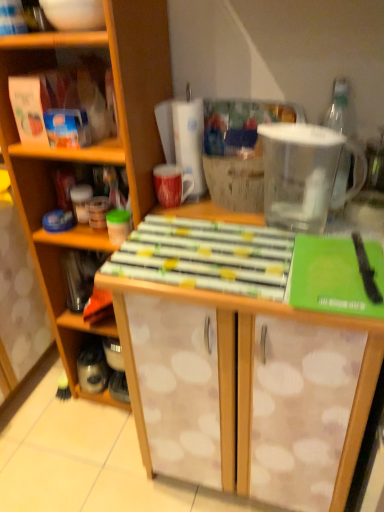
Question: Is white dotted wood cabinet at center positioned beyond the bounds of transparent plastic pitcher at upper right?

Choices:
 (A) yes
 (B) no

Answer: (A)

Question: From the image's perspective, is white dotted wood cabinet at center under transparent plastic pitcher at upper right?

Choices:
 (A) no
 (B) yes

Answer: (B)

Question: Considering the relative sizes of white dotted wood cabinet at center and transparent plastic pitcher at upper right in the image provided, is white dotted wood cabinet at center shorter than transparent plastic pitcher at upper right?

Choices:
 (A) yes
 (B) no

Answer: (B)

Question: From a real-world perspective, is white dotted wood cabinet at center beneath transparent plastic pitcher at upper right?

Choices:
 (A) no
 (B) yes

Answer: (B)

Question: Can you confirm if white dotted wood cabinet at center is smaller than transparent plastic pitcher at upper right?

Choices:
 (A) yes
 (B) no

Answer: (B)

Question: Does white dotted wood cabinet at center appear on the right side of transparent plastic pitcher at upper right?

Choices:
 (A) no
 (B) yes

Answer: (A)

Question: From a real-world perspective, is wooden table at center located higher than white dotted wood cabinet at center?

Choices:
 (A) yes
 (B) no

Answer: (B)

Question: Can you confirm if wooden table at center is bigger than white dotted wood cabinet at center?

Choices:
 (A) yes
 (B) no

Answer: (A)

Question: Is wooden table at center at the right side of white dotted wood cabinet at center?

Choices:
 (A) no
 (B) yes

Answer: (B)

Question: Is wooden table at center smaller than white dotted wood cabinet at center?

Choices:
 (A) no
 (B) yes

Answer: (A)

Question: Could you tell me if wooden table at center is turned towards white dotted wood cabinet at center?

Choices:
 (A) no
 (B) yes

Answer: (A)

Question: Does wooden table at center contain white dotted wood cabinet at center?

Choices:
 (A) no
 (B) yes

Answer: (A)

Question: Is white dotted wood cabinet at center positioned with its back to metallic silver container at left?

Choices:
 (A) no
 (B) yes

Answer: (B)